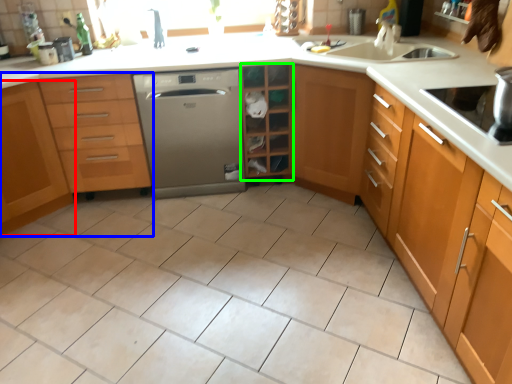
Question: Which object is positioned farthest from cabinetry (highlighted by a red box)? Select from cabinetry (highlighted by a blue box) and shelf (highlighted by a green box).

Choices:
 (A) cabinetry
 (B) shelf

Answer: (B)